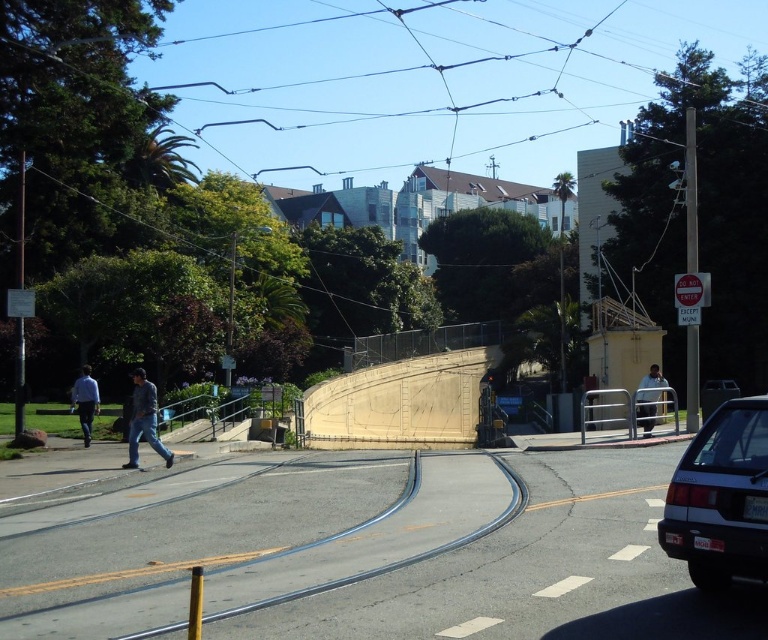
You are a pedestrian standing at the pedestrian crossing and want to cross to the other side. There is a metallic wire at upper center and a light blue shirt at left. Which object is blocking your path?

The metallic wire at upper center is positioned over light blue shirt at left, so the metallic wire at upper center is blocking your path.

You are a delivery drone operator. Your drone is currently at the point indicated by point (425, 77), which is the metallic wire at upper center. You need to fly your drone to the car parked on the right side of the frame. Is there a clear path between the metallic wire at upper center and the car parked on the right side of the frame?

The metallic wire at upper center is located at point (425, 77), and the car is parked on the right side of the frame. Since there are no objects described as blocking the path between them, the drone should have a clear path to fly from the metallic wire at upper center to the car parked on the right side of the frame.

You are a delivery drone operator. Your drone is currently hovering at point coordinates of 0.123, 0.555. There is a metallic wire at upper center located at the same coordinates. Can your drone safely pass through this point without hitting the metallic wire?

The metallic wire at upper center is located exactly at point coordinates of [425,77]. Since the drone is hovering at the same coordinates as the wire, it would be at the same location, so the drone cannot safely pass through this point without colliding with the metallic wire.